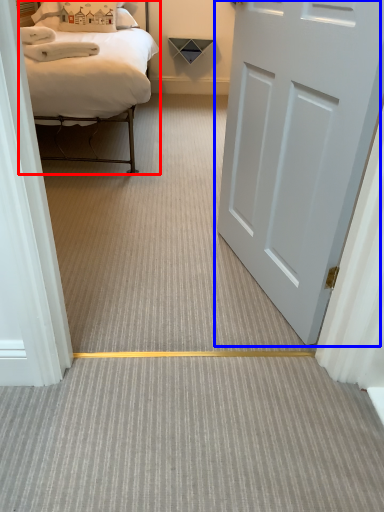
Question: Which of the following is the farthest to the observer, bed (highlighted by a red box) or door (highlighted by a blue box)?

Choices:
 (A) bed
 (B) door

Answer: (A)